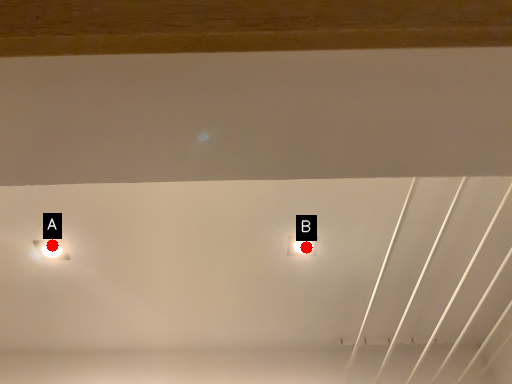
Question: Two points are circled on the image, labeled by A and B beside each circle. Which of the following is the closest to the observer?

Choices:
 (A) A is closer
 (B) B is closer

Answer: (A)